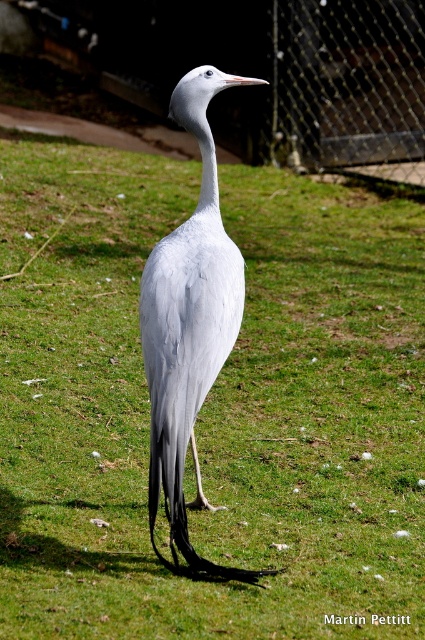
You are a visitor at the zoo and want to take a photo of the gray matte bird at center. The zoo has a rule that visitors must stay at least 2 meters away from any animal. Given that the point representing the bird is located at coordinates point (189, 326), can you determine if you are within the safe distance?

The gray matte bird at center is represented by point (189, 326). Since the coordinates indicate the bird is at the center of the image, you are likely within the required 2 meters distance to comply with the zoo rule. Please move back to ensure safety.

You are observing a crane in a zoo from a distance. You notice two points marked in the image. The first point is at coordinate point (169, 273), and the second is at point (325, 19). Which point is closer to you?

Point (169, 273) is closer to the viewer than point (325, 19).

In the scene shown: You are a zookeeper trying to determine if the gray matte bird at center can fit through the metal mesh fence at upper right. Based on their sizes, can the bird pass through the fence?

The gray matte bird at center is narrower than the metal mesh fence at upper right, so it can potentially pass through the fence.